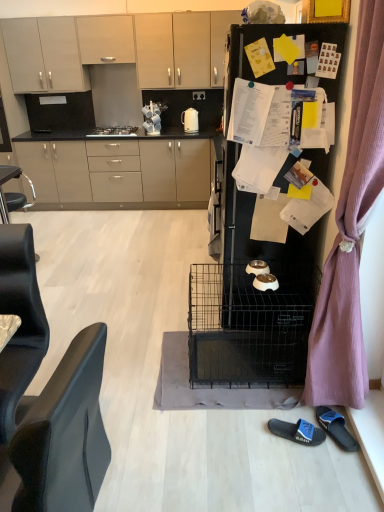
Where is `free space on the front side of white glossy electric kettle at upper center`? This screenshot has width=384, height=512. free space on the front side of white glossy electric kettle at upper center is located at coordinates (188, 135).